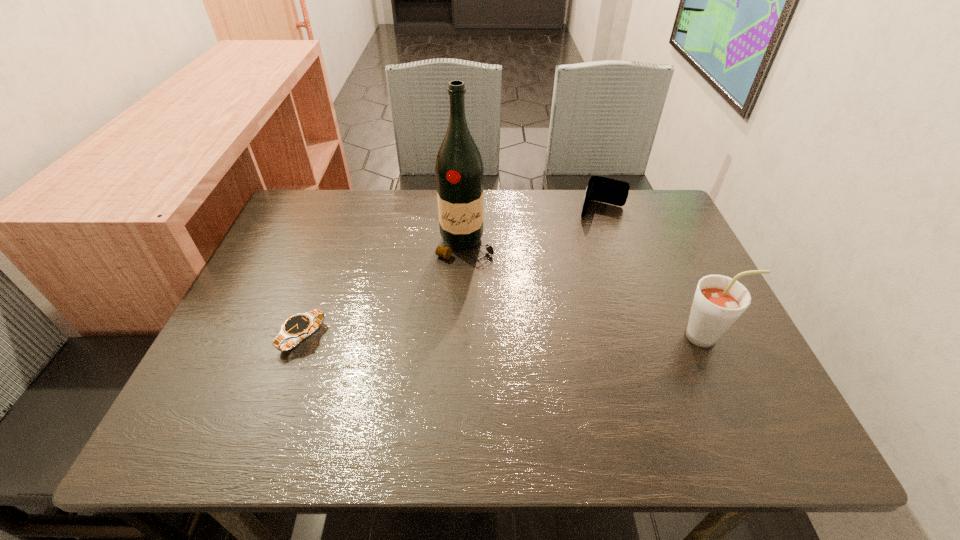
At what (x,y) coordinates should I click in order to perform the action: click on watch. Please return your answer as a coordinate pair (x, y). Looking at the image, I should click on (300, 326).

Where is `the shortest object`? This screenshot has width=960, height=540. the shortest object is located at coordinates [x=300, y=326].

You are a GUI agent. You are given a task and a screenshot of the screen. Output one action in this format:
    pyautogui.click(x=<x>, y=<y>)
    Task: Click on the second tallest object
    The image size is (960, 540).
    Given the screenshot: What is the action you would take?
    pyautogui.click(x=719, y=301)

I want to click on root beer, so coord(719,301).

Find the location of `the third object from right to left`. the third object from right to left is located at coordinates (459, 171).

Where is `the tallest object`? This screenshot has height=540, width=960. the tallest object is located at coordinates (459, 171).

Locate an element on the screen. The width and height of the screenshot is (960, 540). the second object from right to left is located at coordinates (602, 189).

Locate an element on the screen. This screenshot has height=540, width=960. the farthest object is located at coordinates (602, 189).

Find the location of `vacant space located 0.080m on the front of the watch`. vacant space located 0.080m on the front of the watch is located at coordinates (282, 391).

The width and height of the screenshot is (960, 540). Identify the location of free location located 0.110m on the surface of the tallest object. (467, 295).